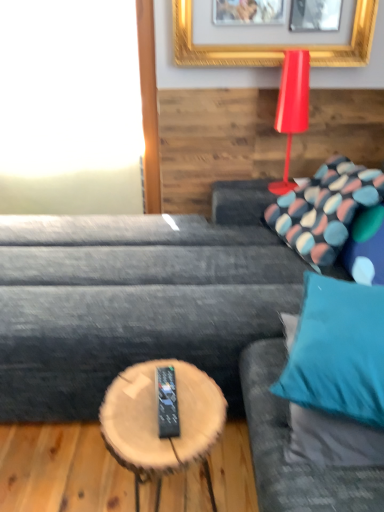
Question: Considering the positions of patterned fabric pillow at upper right, the first pillow from the back, and wooden log coffee table at center in the image, is patterned fabric pillow at upper right, the first pillow from the back, taller or shorter than wooden log coffee table at center?

Choices:
 (A) tall
 (B) short

Answer: (B)

Question: Is patterned fabric pillow at upper right, the second pillow when ordered from bottom to top, in front of or behind wooden log coffee table at center in the image?

Choices:
 (A) behind
 (B) front

Answer: (A)

Question: Considering the real-world distances, which object is farthest from the teal fabric pillow at right, the 1th pillow ordered from the bottom?

Choices:
 (A) white glass window at upper left
 (B) dark gray fabric couch at center
 (C) teal fabric couch at right
 (D) wooden log coffee table at center
 (E) shiny red table lamp at upper right

Answer: (A)

Question: Considering the real-world distances, which object is farthest from the dark gray fabric couch at center?

Choices:
 (A) teal fabric pillow at right, arranged as the 2th pillow when viewed from the top
 (B) shiny red table lamp at upper right
 (C) white glass window at upper left
 (D) teal fabric couch at right
 (E) wooden log coffee table at center

Answer: (C)